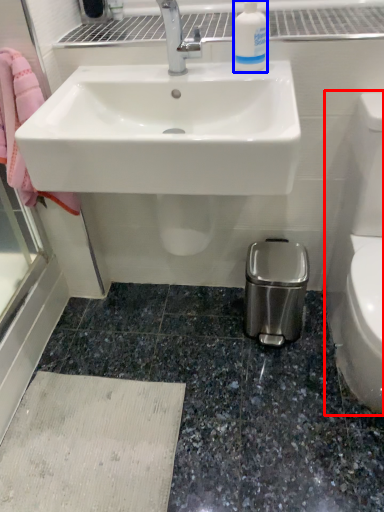
Question: Which point is further to the camera, toilet bowl (highlighted by a red box) or cleaning product (highlighted by a blue box)?

Choices:
 (A) toilet bowl
 (B) cleaning product

Answer: (B)